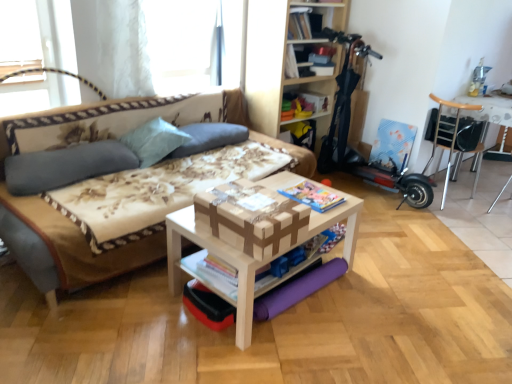
How much space does light blue fabric pillow at upper left, acting as the second pillow starting from the left, occupy horizontally?

35.75 centimeters.

What is the approximate height of light blue fabric pillow at upper left, the second pillow in the right-to-left sequence?

light blue fabric pillow at upper left, the second pillow in the right-to-left sequence, is 28.85 centimeters tall.

What do you see at coordinates (308, 60) in the screenshot?
I see `wooden bookshelf at upper center` at bounding box center [308, 60].

At what (x,y) coordinates should I click in order to perform the action: click on wooden bookshelf at upper center. Please return your answer as a coordinate pair (x, y). This screenshot has height=384, width=512. Looking at the image, I should click on (308, 60).

I want to click on metallic silver chair at upper right, the first table when ordered from top to bottom, so pyautogui.click(x=489, y=110).

What is the approximate width of white wood table at center, the 2th table in the back-to-front sequence?

It is 21.96 inches.

Locate an element on the screen. This screenshot has height=384, width=512. matte paper magazine at center, the 2th magazine from the right is located at coordinates (219, 269).

From the image's perspective, between wooden bookshelf at upper center and metallic silver chair at upper right, the first table when ordered from top to bottom, who is located below?

metallic silver chair at upper right, the first table when ordered from top to bottom, from the image's perspective.

Is wooden bookshelf at upper center located outside metallic silver chair at upper right, which appears as the 2th table when ordered from the bottom?

Yes, wooden bookshelf at upper center is not within metallic silver chair at upper right, which appears as the 2th table when ordered from the bottom.

Considering the relative sizes of wooden bookshelf at upper center and metallic silver chair at upper right, the second table in the left-to-right sequence, in the image provided, is wooden bookshelf at upper center shorter than metallic silver chair at upper right, the second table in the left-to-right sequence,?

Yes, wooden bookshelf at upper center is shorter than metallic silver chair at upper right, the second table in the left-to-right sequence.

Between wooden bookshelf at upper center and metallic silver chair at upper right, the second table in the left-to-right sequence, which one has smaller size?

With smaller size is wooden bookshelf at upper center.

Between metallic silver chair at upper right, which appears as the 2th table when ordered from the bottom, and matte paper magazine at center, the first magazine in the right-to-left sequence, which one has smaller width?

matte paper magazine at center, the first magazine in the right-to-left sequence, is thinner.

Consider the image. Considering the positions of objects metallic silver chair at upper right, positioned as the 2th table in front-to-back order, and matte paper magazine at center, the second magazine from the bottom, in the image provided, who is in front, metallic silver chair at upper right, positioned as the 2th table in front-to-back order, or matte paper magazine at center, the second magazine from the bottom,?

matte paper magazine at center, the second magazine from the bottom, is closer to the camera.

From a real-world perspective, which is physically above, metallic silver chair at upper right, which appears as the 2th table when ordered from the bottom, or matte paper magazine at center, the second magazine from the bottom?

metallic silver chair at upper right, which appears as the 2th table when ordered from the bottom, from a real-world perspective.

In the image, is metallic silver chair at upper right, the second table in the left-to-right sequence, on the left side or the right side of matte paper magazine at center, the 2th magazine from the left?

From the image, it's evident that metallic silver chair at upper right, the second table in the left-to-right sequence, is to the right of matte paper magazine at center, the 2th magazine from the left.

Consider the image. Measure the distance from matte paper magazine at center, the 2th magazine positioned from the top, to wooden chair at right.

A distance of 2.18 meters exists between matte paper magazine at center, the 2th magazine positioned from the top, and wooden chair at right.

Considering the points (260, 274) and (441, 99), which point is behind, point (260, 274) or point (441, 99)?

The point (441, 99) is farther.

Find the location of `chair positioned vertically above the matte paper magazine at center, the 2th magazine from the right (from a real-world perspective)`. chair positioned vertically above the matte paper magazine at center, the 2th magazine from the right (from a real-world perspective) is located at coordinates (454, 140).

Is wooden bookshelf at upper center completely or partially inside matte paper magazine at center, the 2th magazine from the right?

No, wooden bookshelf at upper center is not inside matte paper magazine at center, the 2th magazine from the right.

Does matte paper magazine at center, the 2th magazine positioned from the top, have a greater width compared to wooden bookshelf at upper center?

Incorrect, the width of matte paper magazine at center, the 2th magazine positioned from the top, does not surpass that of wooden bookshelf at upper center.

From the image's perspective, is matte paper magazine at center, the 1th magazine positioned from the bottom, on wooden bookshelf at upper center?

Actually, matte paper magazine at center, the 1th magazine positioned from the bottom, appears below wooden bookshelf at upper center in the image.

The image size is (512, 384). What are the coordinates of `bookcase to the right of matte paper magazine at center, the 2th magazine positioned from the top` in the screenshot? It's located at (315, 51).

From the image's perspective, which one is positioned higher, matte paper magazine at center, the 1th magazine positioned from the bottom, or matte paper magazine at center, which is the 1th magazine from top to bottom?

matte paper magazine at center, which is the 1th magazine from top to bottom, appears higher in the image.

Is matte paper magazine at center, the 1th magazine viewed from the left, not near matte paper magazine at center, the first magazine in the right-to-left sequence?

No.

Is matte paper magazine at center, the 2th magazine from the right, outside of matte paper magazine at center, which is the 1th magazine from top to bottom?

Yes, matte paper magazine at center, the 2th magazine from the right, is located beyond the bounds of matte paper magazine at center, which is the 1th magazine from top to bottom.

Is wooden bookshelf at upper center touching matte paper magazine at center, the 1th magazine positioned from the bottom?

wooden bookshelf at upper center and matte paper magazine at center, the 1th magazine positioned from the bottom, are clearly separated.

From a real-world perspective, between wooden bookshelf at upper center and matte paper magazine at center, the 1th magazine positioned from the bottom, who is vertically lower?

From a 3D spatial view, matte paper magazine at center, the 1th magazine positioned from the bottom, is below.

Which object is further away from the camera taking this photo, wooden bookshelf at upper center or matte paper magazine at center, the 1th magazine positioned from the bottom?

wooden bookshelf at upper center is behind.

Would you consider wooden chair at right to be distant from matte paper magazine at center, the 2th magazine from the right?

wooden chair at right is positioned a significant distance from matte paper magazine at center, the 2th magazine from the right.

Which point is more distant from viewer, (489, 108) or (234, 283)?

The point (489, 108) is farther.

Which object is thinner, wooden chair at right or matte paper magazine at center, the 2th magazine positioned from the top?

matte paper magazine at center, the 2th magazine positioned from the top, is thinner.

What's the angular difference between wooden chair at right and matte paper magazine at center, the 2th magazine positioned from the top,'s facing directions?

They differ by 98.4 degrees in their facing directions.

From a real-world perspective, count 1st tables downward from the wooden bookshelf at upper center and point to it. Please provide its 2D coordinates.

[(489, 110)]

From the image's perspective, starting from the metallic silver chair at upper right, positioned as the 2th table in front-to-back order, which magazine is the 1st one below? Please provide its 2D coordinates.

[(312, 196)]

Based on their spatial positions, is wooden chair at right or wooden bookshelf at upper center further from wooden bookshelf at upper center?

wooden chair at right is further to wooden bookshelf at upper center.

Looking at the image, which one is located closer to matte cardboard storage box at upper center, gray fabric pillow at upper center, the third pillow positioned from the left, or white wood table at center, the 1th table viewed from the front?

The object closer to matte cardboard storage box at upper center is gray fabric pillow at upper center, the third pillow positioned from the left.

Estimate the real-world distances between objects in this image. Which object is closer to matte gray pillow at left, which is the third pillow from right to left, wooden bookshelf at upper center or gray fabric pillow at upper center, the third pillow positioned from the left?

gray fabric pillow at upper center, the third pillow positioned from the left, lies closer to matte gray pillow at left, which is the third pillow from right to left, than the other object.

Looking at this image, which object lies further to the anchor point white wood table at center, acting as the 1th table starting from the left, matte cardboard storage box at upper center or matte gray pillow at left, which is the third pillow from right to left?

matte cardboard storage box at upper center.

From the image, which object appears to be farther from matte cardboard storage box at upper center, matte gray pillow at left, the 1th pillow in the left-to-right sequence, or metallic silver chair at upper right, which appears as the 2th table when ordered from the bottom?

matte gray pillow at left, the 1th pillow in the left-to-right sequence, lies further to matte cardboard storage box at upper center than the other object.

Based on their spatial positions, is white wood table at center, placed as the first table when sorted from bottom to top, or matte gray pillow at left, the 1th pillow in the left-to-right sequence, further from matte paper magazine at center, the 2th magazine from the right?

Based on the image, matte gray pillow at left, the 1th pillow in the left-to-right sequence, appears to be further to matte paper magazine at center, the 2th magazine from the right.

Considering their positions, is beige fabric couch at left positioned further to matte cardboard storage box at upper center than matte gray pillow at left, which is the third pillow from right to left?

Based on the image, beige fabric couch at left appears to be further to matte cardboard storage box at upper center.

Which object lies nearer to the anchor point wooden bookshelf at upper center, matte cardboard storage box at upper center or white wood table at center, the 2th table in the back-to-front sequence?

The object closer to wooden bookshelf at upper center is matte cardboard storage box at upper center.

Where is `storage box between gray fabric pillow at upper center, the third pillow positioned from the left, and wooden chair at right, in the horizontal direction`? The height and width of the screenshot is (384, 512). storage box between gray fabric pillow at upper center, the third pillow positioned from the left, and wooden chair at right, in the horizontal direction is located at coordinates (315, 101).

This screenshot has height=384, width=512. I want to click on storage box between gray fabric pillow at upper center, arranged as the 1th pillow when viewed from the right, and wooden bookshelf at upper center, so [315, 101].

At what (x,y) coordinates should I click in order to perform the action: click on bookcase between matte gray pillow at left, which is the third pillow from right to left, and metallic silver chair at upper right, the 1th table in the right-to-left sequence. Please return your answer as a coordinate pair (x, y). Looking at the image, I should click on (315, 51).

What are the coordinates of `bookcase between white wood table at center, acting as the second table starting from the top, and matte cardboard storage box at upper center in the front-back direction` in the screenshot? It's located at (315, 51).